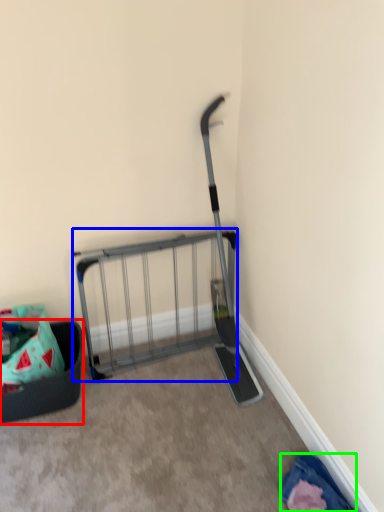
Question: Which object is the closest to the furniture (highlighted by a red box)? Choose among these: cart (highlighted by a blue box) or clothing (highlighted by a green box).

Choices:
 (A) cart
 (B) clothing

Answer: (A)